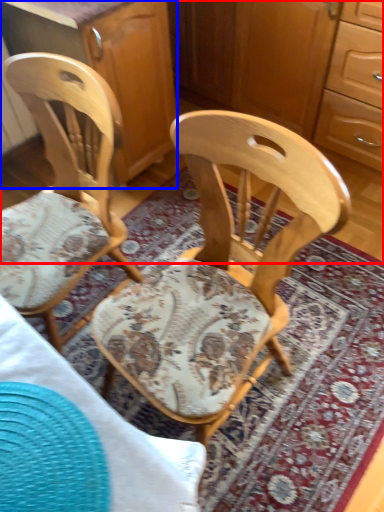
Question: Which object appears closest to the camera in this image, dresser (highlighted by a red box) or cabinetry (highlighted by a blue box)?

Choices:
 (A) dresser
 (B) cabinetry

Answer: (B)